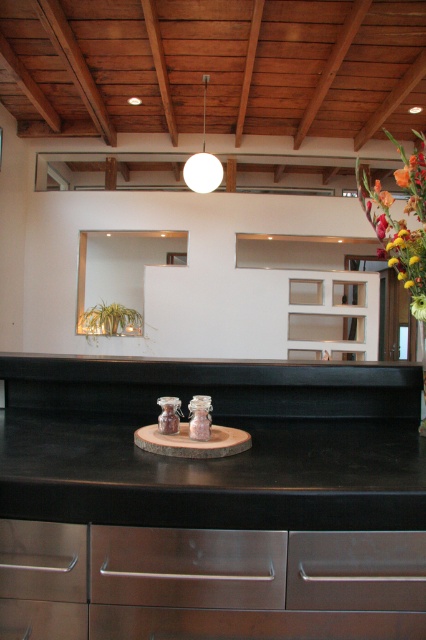
You are standing in the kitchen and see two points marked on the wall. The first point is at coordinate point (x=290, y=568) and the second is at coordinate point (x=71, y=637). Which point is closer to your eyes?

Point (x=290, y=568) is closer to the camera than point (x=71, y=637), so the first point is closer to your eyes.

You are a chef preparing to place a hot pan on the kitchen surface. The black granite countertop at center and the stainless steel drawer at lower left are both visible. Which surface should you avoid placing the pan on to prevent damage?

You should avoid placing the pan on the stainless steel drawer at lower left because the black granite countertop at center is positioned over it, meaning the drawer is likely not a flat surface and may not be designed to hold heavy or hot items.

You are organizing a kitchen drawer system and need to place a set of silverware. The silverware box is 15 cm wide. The satin silver drawer at lower center is 20 cm wide, and the satin brown wood drawer at lower left is 18 cm wide. Which drawer can accommodate the silverware box?

The satin silver drawer at lower center is 20 cm wide, so it can accommodate the 15 cm wide silverware box. The satin brown wood drawer at lower left is 18 cm wide, which is also wide enough, but since the question asks for which can accommodate, both are possible. However, based on the description, the satin silver drawer at lower center is to the right of the satin brown wood drawer at lower left, but that doesn